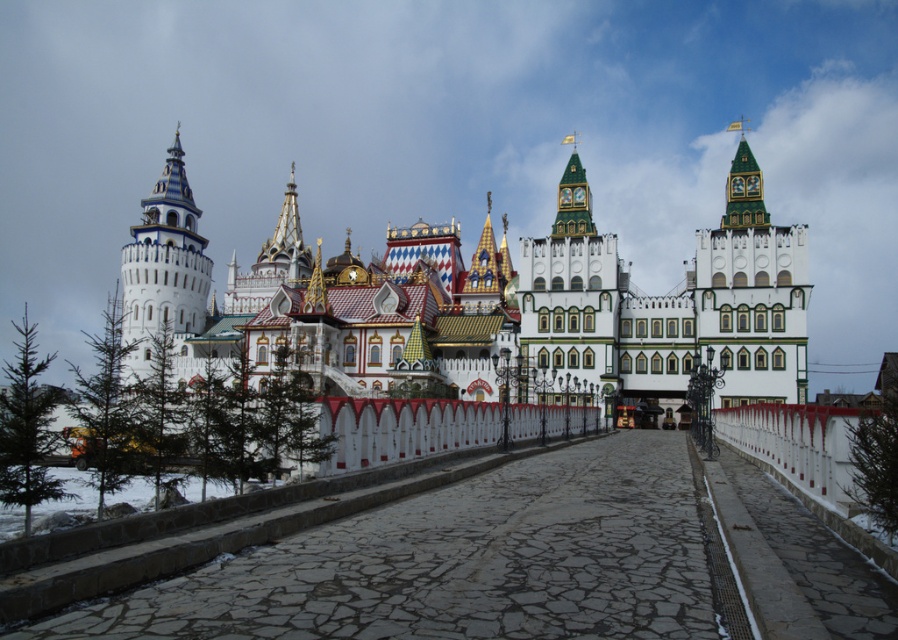
Which is behind, point (190, 305) or point (151, 188)?

The point (151, 188) is more distant.

Can you confirm if white painted stone castle at center is smaller than white painted stone tower at left?

Incorrect, white painted stone castle at center is not smaller in size than white painted stone tower at left.

Who is more forward, (143, 369) or (185, 276)?

Point (143, 369) is in front.

Find the location of `white painted stone castle at center`. white painted stone castle at center is located at coordinates (487, 301).

Measure the distance between white painted stone tower at right and camera.

A distance of 84.40 meters exists between white painted stone tower at right and camera.

Is white painted stone tower at right bigger than white painted stone tower at left?

Correct, white painted stone tower at right is larger in size than white painted stone tower at left.

Which is in front, point (772, 372) or point (165, 202)?

Point (772, 372) is in front.

Where is `white painted stone tower at right`? The height and width of the screenshot is (640, 898). white painted stone tower at right is located at coordinates (751, 292).

Which of these two, white painted stone castle at center or white painted stone tower at right, stands taller?

white painted stone castle at center

Can you confirm if white painted stone castle at center is wider than white painted stone tower at right?

Indeed, white painted stone castle at center has a greater width compared to white painted stone tower at right.

This screenshot has width=898, height=640. What do you see at coordinates (487, 301) in the screenshot? I see `white painted stone castle at center` at bounding box center [487, 301].

Image resolution: width=898 pixels, height=640 pixels. I want to click on white painted stone castle at center, so click(487, 301).